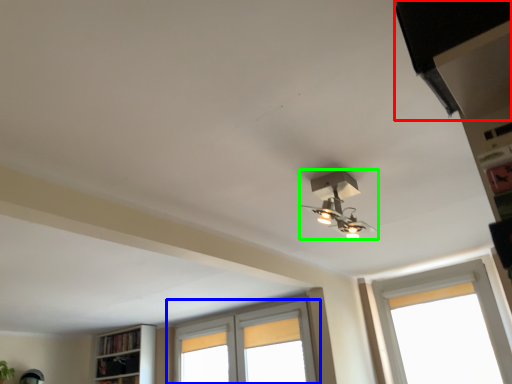
Question: Considering the real-world distances, which object is closest to exhaust hood (highlighted by a red box)? window (highlighted by a blue box) or lamp (highlighted by a green box).

Choices:
 (A) window
 (B) lamp

Answer: (B)